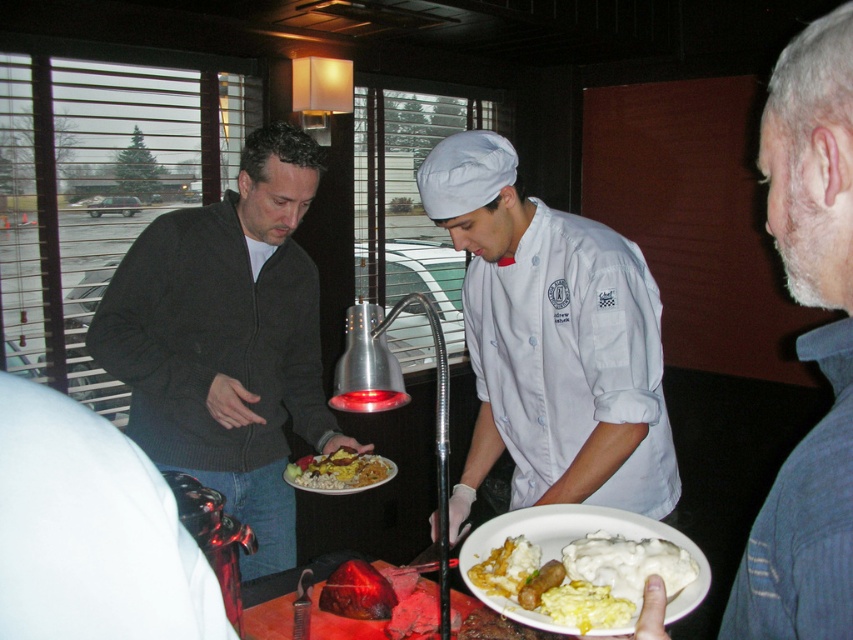
Is gray beard at right to the left of golden brown bread at center from the viewer's perspective?

Incorrect, gray beard at right is not on the left side of golden brown bread at center.

Between gray beard at right and golden brown bread at center, which one has less height?

golden brown bread at center is shorter.

Describe the element at coordinates (808, 346) in the screenshot. I see `gray beard at right` at that location.

Identify the location of gray beard at right. This screenshot has height=640, width=853. (808, 346).

Is white creamy mashed potatoes at lower center positioned in front of golden brown bread at center?

Yes.

Consider the image. Who is positioned more to the left, white creamy mashed potatoes at lower center or golden brown bread at center?

golden brown bread at center is more to the left.

Measure the distance between white creamy mashed potatoes at lower center and camera.

They are 30.53 inches apart.

The image size is (853, 640). Find the location of `white creamy mashed potatoes at lower center`. white creamy mashed potatoes at lower center is located at coordinates (589, 564).

Who is higher up, dark gray sweater at left or white cotton chef's coat at center?

white cotton chef's coat at center is higher up.

Measure the distance between dark gray sweater at left and white cotton chef's coat at center.

dark gray sweater at left is 22.43 inches from white cotton chef's coat at center.

This screenshot has height=640, width=853. Describe the element at coordinates (227, 340) in the screenshot. I see `dark gray sweater at left` at that location.

Where is `dark gray sweater at left`? dark gray sweater at left is located at coordinates (227, 340).